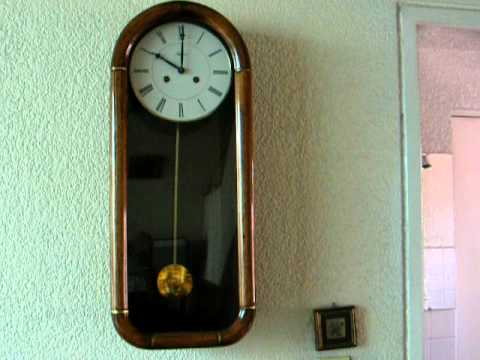
Find the location of `shiny brown rim around clock`. shiny brown rim around clock is located at coordinates (244, 89).